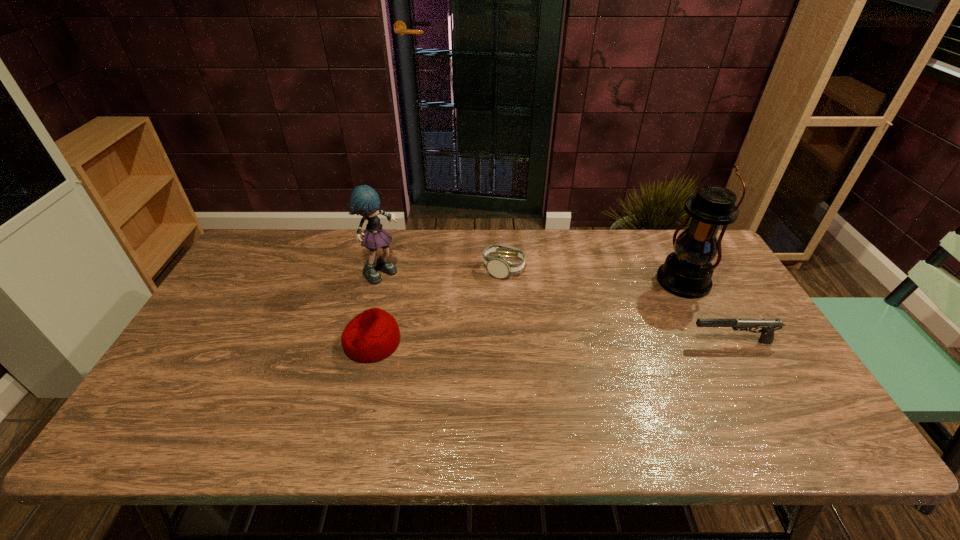
Where is `vacant region located at the muzzle end of the gun`? The height and width of the screenshot is (540, 960). vacant region located at the muzzle end of the gun is located at coordinates (641, 342).

Where is `free spot located 0.050m on the front-facing side of the second tallest object`? The image size is (960, 540). free spot located 0.050m on the front-facing side of the second tallest object is located at coordinates (410, 285).

This screenshot has width=960, height=540. I want to click on vacant space positioned on the front-facing side of the second tallest object, so click(x=410, y=285).

You are a GUI agent. You are given a task and a screenshot of the screen. Output one action in this format:
    pyautogui.click(x=<x>, y=<y>)
    Task: Click on the free space located 0.260m on the front-facing side of the second tallest object
    This screenshot has width=960, height=540.
    Given the screenshot: What is the action you would take?
    pyautogui.click(x=466, y=313)

At what (x,y) coordinates should I click in order to perform the action: click on vacant space located 0.070m on the face of the third object from left to right. Please return your answer as a coordinate pair (x, y). Looking at the image, I should click on (528, 293).

Identify the location of vacant space located on the face of the third object from left to right. (540, 306).

The height and width of the screenshot is (540, 960). I want to click on vacant space located 0.200m on the face of the third object from left to right, so click(554, 321).

Locate several spots in the free space located 0.380m above the lantern, indicating its light source. Please provide its 2D coordinates. Your answer should be formatted as a tuple, i.e. [(x, y)], where the tuple contains the x and y coordinates of a point satisfying the conditions above.

[(567, 342)]

Locate several spots in free space located 0.050m above the lantern, indicating its light source. Please provide its 2D coordinates. Your answer should be formatted as a tuple, i.e. [(x, y)], where the tuple contains the x and y coordinates of a point satisfying the conditions above.

[(653, 296)]

Locate several points within vacant space situated 0.210m above the lantern, indicating its light source. Please provide its 2D coordinates. Your answer should be formatted as a tuple, i.e. [(x, y)], where the tuple contains the x and y coordinates of a point satisfying the conditions above.

[(613, 318)]